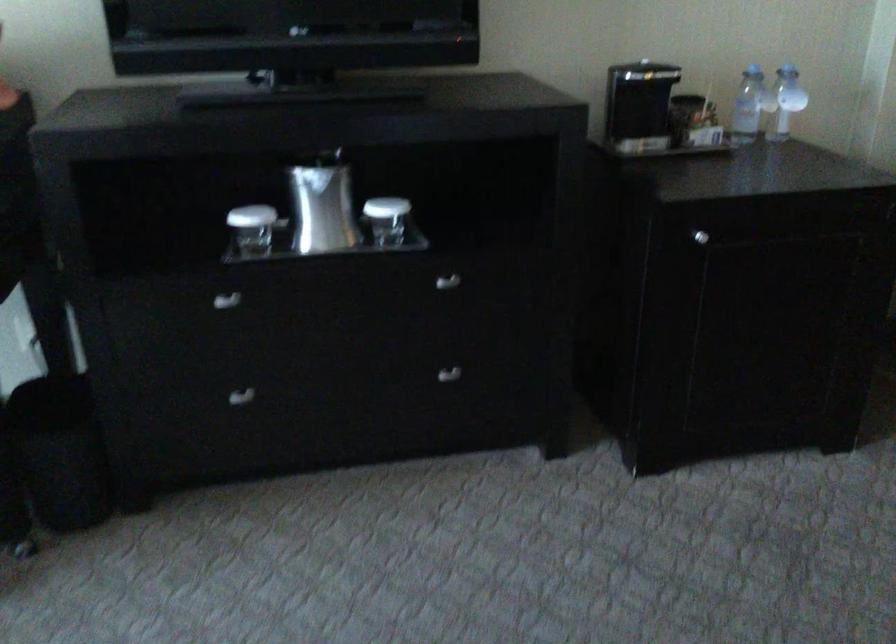
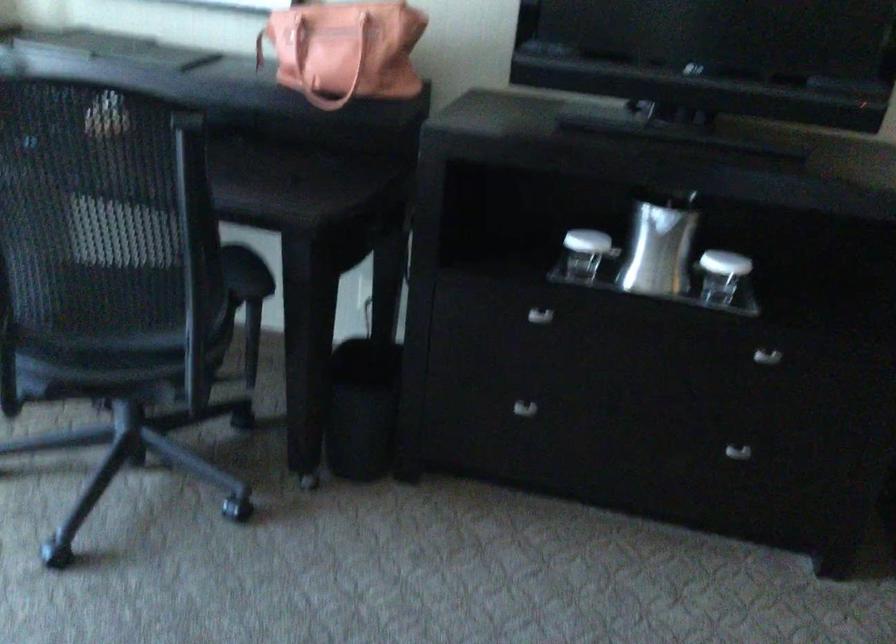
Locate, in the second image, the point that corresponds to the point at 250,225 in the first image.

(586, 252)